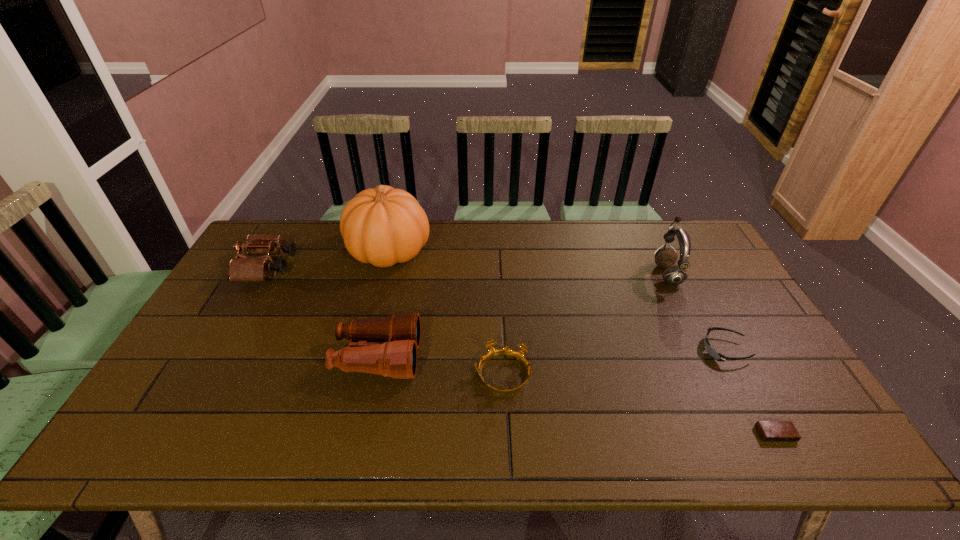
This screenshot has height=540, width=960. I want to click on the tallest object, so click(383, 226).

The height and width of the screenshot is (540, 960). What are the coordinates of `earphone` in the screenshot? It's located at (673, 275).

The width and height of the screenshot is (960, 540). I want to click on the left binoculars, so 247,269.

The image size is (960, 540). I want to click on the farther binoculars, so click(247, 269).

Locate an element on the screen. This screenshot has height=540, width=960. the nearer binoculars is located at coordinates (387, 346).

You are a GUI agent. You are given a task and a screenshot of the screen. Output one action in this format:
    pyautogui.click(x=<x>, y=<y>)
    Task: Click on the fourth object from right to left
    This screenshot has width=960, height=540.
    Given the screenshot: What is the action you would take?
    click(506, 351)

The width and height of the screenshot is (960, 540). I want to click on crown, so tap(506, 351).

Find the location of `sunglasses`. sunglasses is located at coordinates (714, 354).

Locate an element on the screen. The image size is (960, 540). the shortest object is located at coordinates (770, 431).

What are the coordinates of `the nearest object` in the screenshot? It's located at (770, 431).